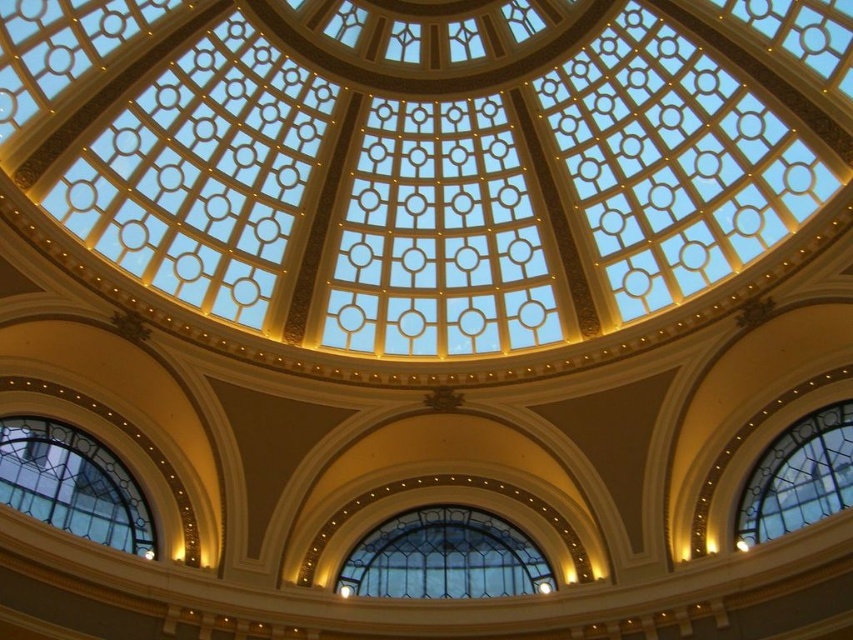
You are an architect analyzing the dome structure. You need to determine which clear glass window is larger in size between the clear glass window at center and the clear glass window at lower left. Based on the description, which one is bigger?

The clear glass window at lower left is larger than the clear glass window at center because the description states that the clear glass window at center occupies less space than clear glass window at lower left.